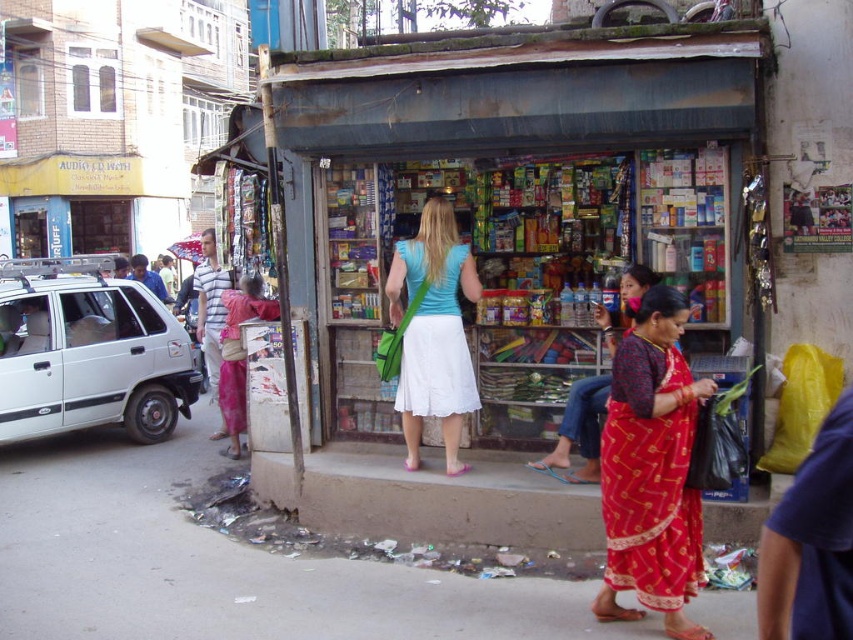
Who is shorter, dirty concrete pavement at lower center or light blue fabric shirt at center?

dirty concrete pavement at lower center is shorter.

Consider the image. Is the position of dirty concrete pavement at lower center less distant than that of light blue fabric shirt at center?

No, dirty concrete pavement at lower center is behind light blue fabric shirt at center.

Where is `dirty concrete pavement at lower center`? dirty concrete pavement at lower center is located at coordinates (222, 563).

At what (x,y) coordinates should I click in order to perform the action: click on dirty concrete pavement at lower center. Please return your answer as a coordinate pair (x, y). Image resolution: width=853 pixels, height=640 pixels. Looking at the image, I should click on (222, 563).

Can you confirm if red printed sari at lower right is smaller than red silk saree at center?

Actually, red printed sari at lower right might be larger than red silk saree at center.

This screenshot has width=853, height=640. What do you see at coordinates (651, 470) in the screenshot?
I see `red printed sari at lower right` at bounding box center [651, 470].

Where is `red printed sari at lower right`? red printed sari at lower right is located at coordinates (651, 470).

Who is shorter, brown concrete curb at lower center or light blue fabric shirt at center?

Standing shorter between the two is brown concrete curb at lower center.

From the picture: Is brown concrete curb at lower center taller than light blue fabric shirt at center?

No.

Is point (590, 536) positioned before point (469, 362)?

That is True.

The width and height of the screenshot is (853, 640). In order to click on brown concrete curb at lower center in this screenshot , I will do `click(430, 499)`.